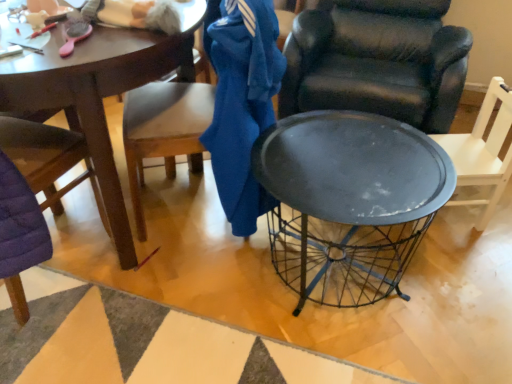
Measure the distance between matte black chair at right, positioned as the fourth chair in left-to-right order, and camera.

matte black chair at right, positioned as the fourth chair in left-to-right order, is 5.01 feet away from camera.

The height and width of the screenshot is (384, 512). Describe the element at coordinates (483, 150) in the screenshot. I see `matte black chair at right, positioned as the fourth chair in left-to-right order` at that location.

Locate an element on the screen. The height and width of the screenshot is (384, 512). purple quilted chair at left, marked as the 4th chair in a right-to-left arrangement is located at coordinates (47, 158).

What is the approximate width of metallic wire basket at center?

The width of metallic wire basket at center is 1.02 meters.

What is the approximate height of metallic wire basket at center?

metallic wire basket at center is 30.54 inches in height.

Describe the element at coordinates (349, 202) in the screenshot. I see `metallic black table at center` at that location.

This screenshot has height=384, width=512. Describe the element at coordinates (377, 61) in the screenshot. I see `matte black chair at center, the third chair from the left` at that location.

What is the approximate height of matte black chair at center, the 2th chair when ordered from right to left?

matte black chair at center, the 2th chair when ordered from right to left, is 31.65 inches tall.

The image size is (512, 384). What are the coordinates of `blue cotton jacket at center` in the screenshot? It's located at (241, 102).

Is point (185, 50) more distant than point (228, 201)?

No, (185, 50) is closer to viewer.

Which of these two, metallic wire basket at center or blue cotton jacket at center, is smaller?

With smaller size is blue cotton jacket at center.

Is metallic wire basket at center inside or outside of blue cotton jacket at center?

metallic wire basket at center is outside blue cotton jacket at center.

Looking at this image, is metallic wire basket at center not close to blue cotton jacket at center?

No, metallic wire basket at center is not far away from blue cotton jacket at center.

Does purple quilted chair at left, marked as the 4th chair in a right-to-left arrangement, turn towards metallic wire basket at center?

Yes, purple quilted chair at left, marked as the 4th chair in a right-to-left arrangement, is facing metallic wire basket at center.

From a real-world perspective, is purple quilted chair at left, the 1th chair when ordered from left to right, located beneath metallic wire basket at center?

No, from a real-world perspective, purple quilted chair at left, the 1th chair when ordered from left to right, is not under metallic wire basket at center.

Which is behind, point (15, 302) or point (91, 39)?

Point (15, 302)

Is purple quilted chair at left, marked as the 4th chair in a right-to-left arrangement, at the right side of metallic wire basket at center?

Incorrect, purple quilted chair at left, marked as the 4th chair in a right-to-left arrangement, is not on the right side of metallic wire basket at center.

Does metallic wire basket at center lie in front of purple quilted chair at left, marked as the 4th chair in a right-to-left arrangement?

No, it is behind purple quilted chair at left, marked as the 4th chair in a right-to-left arrangement.

The image size is (512, 384). What are the coordinates of `the 3rd chair located above the metallic wire basket at center (from a real-world perspective)` in the screenshot? It's located at (47, 158).

Between point (126, 51) and point (12, 153), which one is positioned behind?

Point (12, 153)

Considering the relative sizes of metallic wire basket at center and purple quilted chair at left, marked as the 4th chair in a right-to-left arrangement, in the image provided, is metallic wire basket at center bigger than purple quilted chair at left, marked as the 4th chair in a right-to-left arrangement,?

Indeed, metallic wire basket at center has a larger size compared to purple quilted chair at left, marked as the 4th chair in a right-to-left arrangement.

From the picture: Which point is more forward, [500,174] or [262,198]?

The point [500,174] is in front.

Which object is further away from the camera taking this photo, matte black chair at right, positioned as the fourth chair in left-to-right order, or blue cotton jacket at center?

matte black chair at right, positioned as the fourth chair in left-to-right order, is further away from the camera.

Would you say matte black chair at right, which ranks as the 1th chair in right-to-left order, contains blue cotton jacket at center?

No, blue cotton jacket at center is not inside matte black chair at right, which ranks as the 1th chair in right-to-left order.

Looking at this image, from a real-world perspective, between matte black chair at right, positioned as the fourth chair in left-to-right order, and blue cotton jacket at center, who is vertically higher?

blue cotton jacket at center.

From the picture: Which of these two, metallic wire basket at center or matte black chair at right, positioned as the fourth chair in left-to-right order, is thinner?

matte black chair at right, positioned as the fourth chair in left-to-right order.

From the image's perspective, is metallic wire basket at center located above or below matte black chair at right, which ranks as the 1th chair in right-to-left order?

Based on their image positions, metallic wire basket at center is located above matte black chair at right, which ranks as the 1th chair in right-to-left order.

In the scene shown: In terms of height, does metallic wire basket at center look taller or shorter compared to matte black chair at right, positioned as the fourth chair in left-to-right order?

metallic wire basket at center is taller than matte black chair at right, positioned as the fourth chair in left-to-right order.

Which of these two, matte black chair at right, which ranks as the 1th chair in right-to-left order, or wooden chair at left, arranged as the second chair when viewed from the left, stands shorter?

matte black chair at right, which ranks as the 1th chair in right-to-left order, is shorter.

In the image, is matte black chair at right, positioned as the fourth chair in left-to-right order, positioned in front of or behind wooden chair at left, arranged as the second chair when viewed from the left?

matte black chair at right, positioned as the fourth chair in left-to-right order, is positioned farther from the viewer than wooden chair at left, arranged as the second chair when viewed from the left.

How many degrees apart are the facing directions of matte black chair at right, which ranks as the 1th chair in right-to-left order, and wooden chair at left, placed as the third chair when sorted from right to left?

The angle between the facing direction of matte black chair at right, which ranks as the 1th chair in right-to-left order, and the facing direction of wooden chair at left, placed as the third chair when sorted from right to left, is 7.38 degrees.

Is matte black chair at right, which ranks as the 1th chair in right-to-left order, to the left of wooden chair at left, placed as the third chair when sorted from right to left, from the viewer's perspective?

No.

Is purple quilted chair at left, the 1th chair when ordered from left to right, not within matte black chair at center, the third chair from the left?

Indeed, purple quilted chair at left, the 1th chair when ordered from left to right, is completely outside matte black chair at center, the third chair from the left.

Between purple quilted chair at left, marked as the 4th chair in a right-to-left arrangement, and matte black chair at center, the third chair from the left, which one has less height?

matte black chair at center, the third chair from the left.

You are a GUI agent. You are given a task and a screenshot of the screen. Output one action in this format:
    pyautogui.click(x=<x>, y=<y>)
    Task: Click on the coffee table below the blue cotton jacket at center (from the image's perspective)
    The width and height of the screenshot is (512, 384).
    Given the screenshot: What is the action you would take?
    pyautogui.click(x=100, y=95)

I want to click on coffee table below the purple quilted chair at left, marked as the 4th chair in a right-to-left arrangement (from a real-world perspective), so [x=100, y=95].

From the image, which object appears to be farther from metallic black table at center, purple quilted chair at left, the 1th chair when ordered from left to right, or matte black chair at center, the third chair from the left?

Based on the image, purple quilted chair at left, the 1th chair when ordered from left to right, appears to be further to metallic black table at center.

Which object lies further to the anchor point purple quilted chair at left, the 1th chair when ordered from left to right, matte black chair at right, which ranks as the 1th chair in right-to-left order, or blue cotton jacket at center?

Among the two, matte black chair at right, which ranks as the 1th chair in right-to-left order, is located further to purple quilted chair at left, the 1th chair when ordered from left to right.

Estimate the real-world distances between objects in this image. Which object is closer to purple quilted chair at left, the 1th chair when ordered from left to right, metallic black table at center or blue cotton jacket at center?

Based on the image, blue cotton jacket at center appears to be nearer to purple quilted chair at left, the 1th chair when ordered from left to right.

Estimate the real-world distances between objects in this image. Which object is further from metallic wire basket at center, matte black chair at center, the 2th chair when ordered from right to left, or metallic black table at center?

matte black chair at center, the 2th chair when ordered from right to left, lies further to metallic wire basket at center than the other object.

From the image, which object appears to be nearer to blue cotton jacket at center, wooden chair at left, arranged as the second chair when viewed from the left, or metallic black table at center?

The object closer to blue cotton jacket at center is wooden chair at left, arranged as the second chair when viewed from the left.

From the image, which object appears to be nearer to metallic wire basket at center, matte black chair at right, positioned as the fourth chair in left-to-right order, or metallic black table at center?

metallic black table at center lies closer to metallic wire basket at center than the other object.

Looking at the image, which one is located further to purple quilted chair at left, marked as the 4th chair in a right-to-left arrangement, matte black chair at right, positioned as the fourth chair in left-to-right order, or metallic black table at center?

Based on the image, matte black chair at right, positioned as the fourth chair in left-to-right order, appears to be further to purple quilted chair at left, marked as the 4th chair in a right-to-left arrangement.

Looking at the image, which one is located closer to metallic wire basket at center, wooden chair at left, placed as the third chair when sorted from right to left, or blue cotton jacket at center?

Based on the image, wooden chair at left, placed as the third chair when sorted from right to left, appears to be nearer to metallic wire basket at center.

Find the location of a particular element. The height and width of the screenshot is (384, 512). desk located between metallic wire basket at center and matte black chair at center, the 2th chair when ordered from right to left, in the left-right direction is located at coordinates (349, 202).

The image size is (512, 384). In order to click on clothing between matte black chair at center, the 2th chair when ordered from right to left, and metallic black table at center from top to bottom in this screenshot , I will do (x=241, y=102).

I want to click on chair between blue cotton jacket at center and matte black chair at right, which ranks as the 1th chair in right-to-left order, from left to right, so click(377, 61).

Image resolution: width=512 pixels, height=384 pixels. I want to click on chair located between metallic wire basket at center and matte black chair at center, the 2th chair when ordered from right to left, in the left-right direction, so click(189, 143).